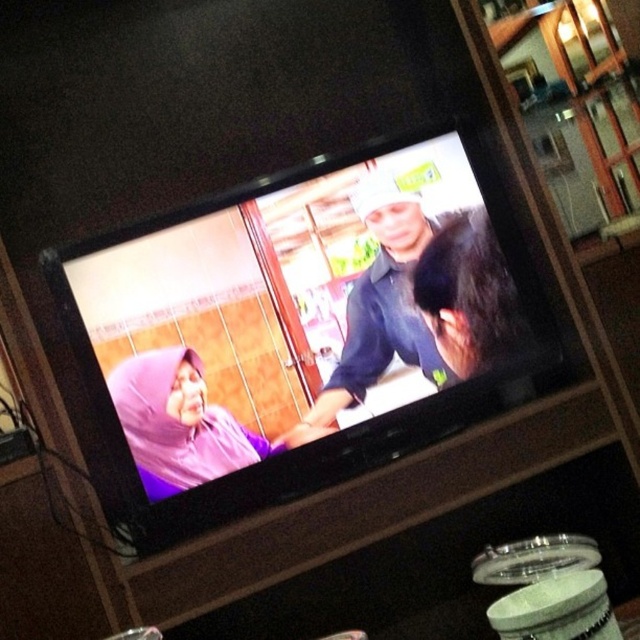
Consider the image. Can you confirm if dark blue shirt at center is thinner than purple fabric headscarf at center?

Yes.

Which is below, dark blue shirt at center or purple fabric headscarf at center?

purple fabric headscarf at center is below.

Is point (387, 184) less distant than point (202, 451)?

No, it is not.

Where is `dark blue shirt at center`? Image resolution: width=640 pixels, height=640 pixels. dark blue shirt at center is located at coordinates (384, 301).